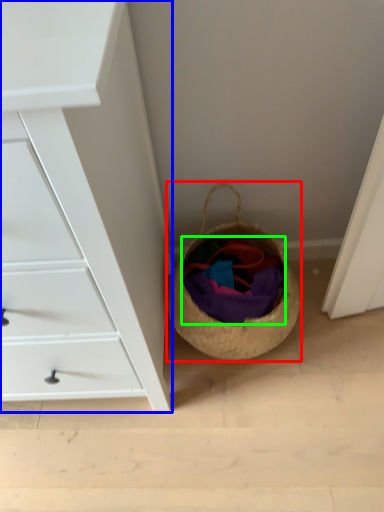
Question: Considering the real-world distances, which object is farthest from basket (highlighted by a red box)? chest of drawers (highlighted by a blue box) or clothing (highlighted by a green box)?

Choices:
 (A) chest of drawers
 (B) clothing

Answer: (A)